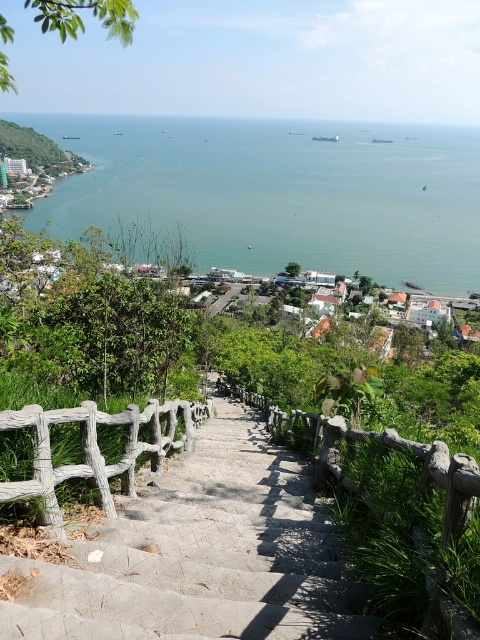
Does point (157, 179) come farther from viewer compared to point (262, 637)?

Yes, it is behind point (262, 637).

Which is in front, point (424, 168) or point (79, 616)?

Point (79, 616) is in front.

What do you see at coordinates (279, 193) in the screenshot?
I see `green water at center` at bounding box center [279, 193].

I want to click on green water at center, so click(279, 193).

Is wooden at center further to camera compared to weathered wood fence at lower left?

No, it is in front of weathered wood fence at lower left.

Which is behind, point (419, 444) or point (58, 506)?

The point (58, 506) is more distant.

This screenshot has width=480, height=640. What do you see at coordinates (396, 513) in the screenshot? I see `wooden at center` at bounding box center [396, 513].

This screenshot has height=640, width=480. I want to click on wooden at center, so click(396, 513).

Which is below, green water at center or weathered wood fence at lower left?

weathered wood fence at lower left is below.

Who is more distant from viewer, (455, 128) or (45, 492)?

The point (455, 128) is behind.

At what (x,y) coordinates should I click in order to perform the action: click on green water at center. Please return your answer as a coordinate pair (x, y). Image resolution: width=480 pixels, height=640 pixels. Looking at the image, I should click on (279, 193).